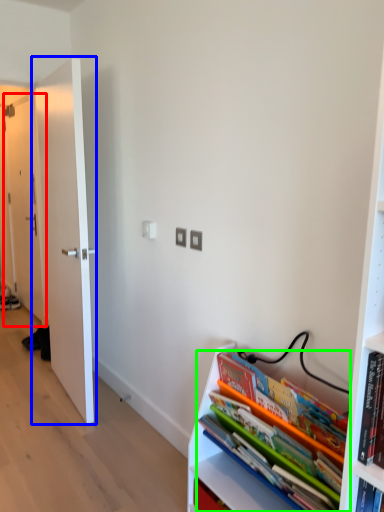
Question: Which object is positioned farthest from door (highlighted by a red box)? Select from door (highlighted by a blue box) and book (highlighted by a green box).

Choices:
 (A) door
 (B) book

Answer: (B)